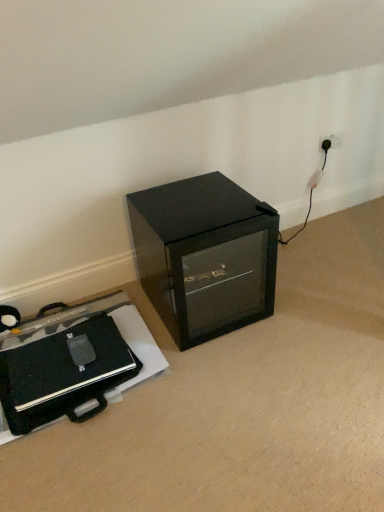
Question: Is black glass cabinet at center positioned with its back to black matte briefcase at lower left?

Choices:
 (A) no
 (B) yes

Answer: (A)

Question: From the image's perspective, is black glass cabinet at center on top of black matte briefcase at lower left?

Choices:
 (A) no
 (B) yes

Answer: (B)

Question: Considering the relative positions of black glass cabinet at center and black matte briefcase at lower left in the image provided, is black glass cabinet at center to the right of black matte briefcase at lower left from the viewer's perspective?

Choices:
 (A) yes
 (B) no

Answer: (A)

Question: Can you confirm if black glass cabinet at center is thinner than black matte briefcase at lower left?

Choices:
 (A) no
 (B) yes

Answer: (A)

Question: Is black glass cabinet at center closer to the viewer compared to black matte briefcase at lower left?

Choices:
 (A) yes
 (B) no

Answer: (B)

Question: Considering the relative positions of black glass cabinet at center and black matte briefcase at lower left in the image provided, is black glass cabinet at center behind black matte briefcase at lower left?

Choices:
 (A) yes
 (B) no

Answer: (A)

Question: Is black matte briefcase at lower left at the left side of black glass cabinet at center?

Choices:
 (A) yes
 (B) no

Answer: (A)

Question: From a real-world perspective, is black matte briefcase at lower left on black glass cabinet at center?

Choices:
 (A) no
 (B) yes

Answer: (A)

Question: Is black matte briefcase at lower left turned away from black glass cabinet at center?

Choices:
 (A) yes
 (B) no

Answer: (B)

Question: Does black matte briefcase at lower left appear on the right side of black glass cabinet at center?

Choices:
 (A) no
 (B) yes

Answer: (A)

Question: Considering the relative sizes of black matte briefcase at lower left and black glass cabinet at center in the image provided, is black matte briefcase at lower left thinner than black glass cabinet at center?

Choices:
 (A) no
 (B) yes

Answer: (B)

Question: From the image's perspective, would you say black matte briefcase at lower left is positioned over black glass cabinet at center?

Choices:
 (A) yes
 (B) no

Answer: (B)

Question: Looking at the image, does black matte briefcase at lower left seem bigger or smaller compared to black glass cabinet at center?

Choices:
 (A) small
 (B) big

Answer: (A)